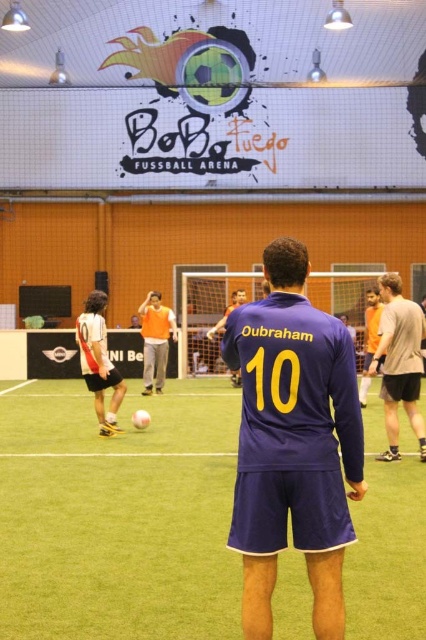
Question: Which point is closer to the camera?

Choices:
 (A) purple jersey at center
 (B) green artificial turf at center
 (C) purple matte jersey at center
 (D) gray cotton shirt at right

Answer: (C)

Question: Which point is closer to the camera?

Choices:
 (A) purple jersey at center
 (B) green artificial turf at center
 (C) gray cotton shirt at right

Answer: (B)

Question: Can you confirm if purple matte jersey at center is thinner than orange jersey at center?

Choices:
 (A) yes
 (B) no

Answer: (A)

Question: Is green artificial turf at center further to camera compared to purple jersey at center?

Choices:
 (A) yes
 (B) no

Answer: (B)

Question: Can you confirm if yellow matte/texture number at center is positioned to the right of orange jersey at center?

Choices:
 (A) no
 (B) yes

Answer: (B)

Question: Which point is closer to the camera taking this photo?

Choices:
 (A) (143, 394)
 (B) (46, 618)

Answer: (B)